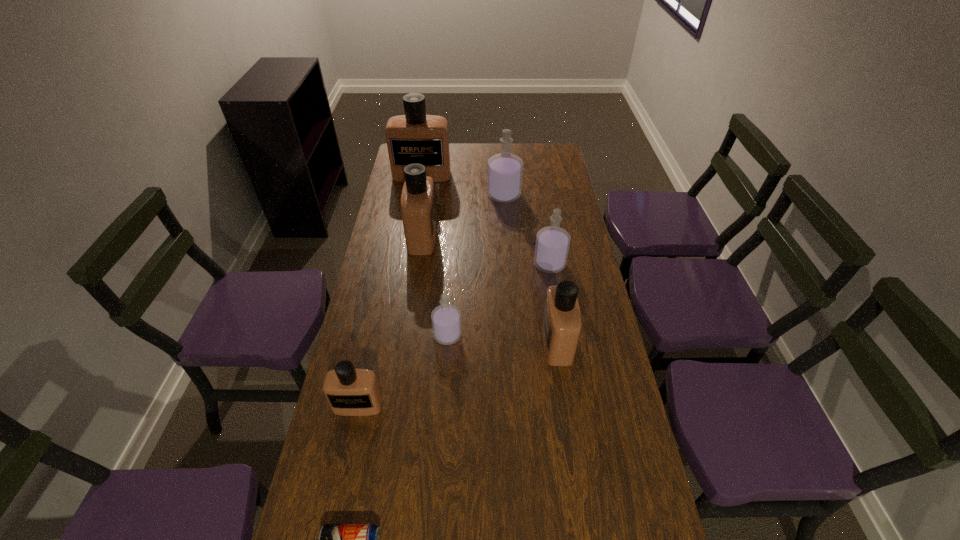
Where is `free space that satisfies the following two spatial constraints: 1. on the front label of the second farthest purple perfume; 2. on the right side of the farthest perfume`? free space that satisfies the following two spatial constraints: 1. on the front label of the second farthest purple perfume; 2. on the right side of the farthest perfume is located at coordinates (407, 264).

The height and width of the screenshot is (540, 960). Identify the location of vacant point that satisfies the following two spatial constraints: 1. on the back side of the nearest purple perfume; 2. on the front label of the third smallest beige perfume. (454, 237).